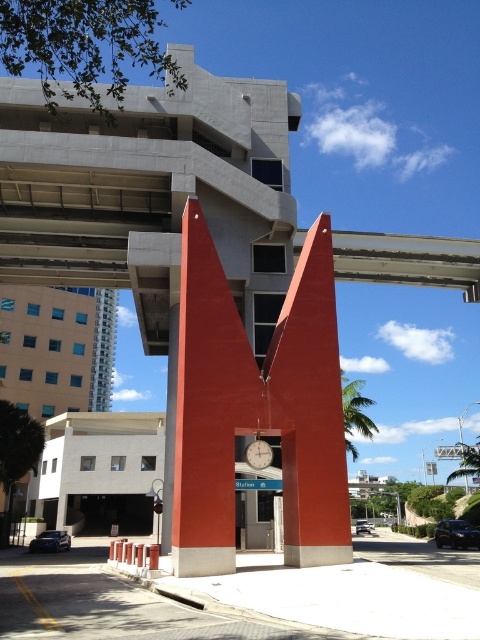
Can you confirm if smooth red pillar at center is positioned to the right of metallic silver clock at center?

No, smooth red pillar at center is not to the right of metallic silver clock at center.

Between smooth red pillar at center and metallic silver clock at center, which one is positioned higher?

Positioned higher is smooth red pillar at center.

Which is behind, point (232, 310) or point (259, 448)?

The point (232, 310) is more distant.

Identify the location of smooth red pillar at center. Image resolution: width=480 pixels, height=640 pixels. (208, 406).

Which is below, smooth red pillar at center or smooth orange pillar at center?

smooth red pillar at center is lower down.

Which is more to the right, smooth red pillar at center or smooth orange pillar at center?

smooth orange pillar at center

Between point (191, 224) and point (303, 422), which one is positioned behind?

Positioned behind is point (191, 224).

Locate an element on the screen. This screenshot has height=640, width=480. smooth red pillar at center is located at coordinates (208, 406).

Who is positioned more to the left, smooth orange pillar at center or metallic silver clock at center?

metallic silver clock at center

Image resolution: width=480 pixels, height=640 pixels. What do you see at coordinates (310, 410) in the screenshot?
I see `smooth orange pillar at center` at bounding box center [310, 410].

Who is more forward, (312, 515) or (268, 460)?

Point (312, 515) is more forward.

This screenshot has height=640, width=480. I want to click on smooth orange pillar at center, so click(x=310, y=410).